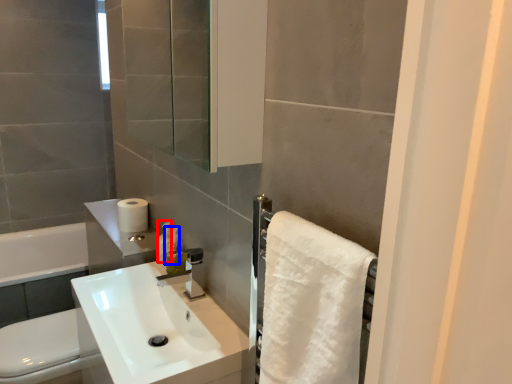
Question: Which of the following is the closest to the observer, toiletry (highlighted by a red box) or soap dispenser (highlighted by a blue box)?

Choices:
 (A) toiletry
 (B) soap dispenser

Answer: (B)